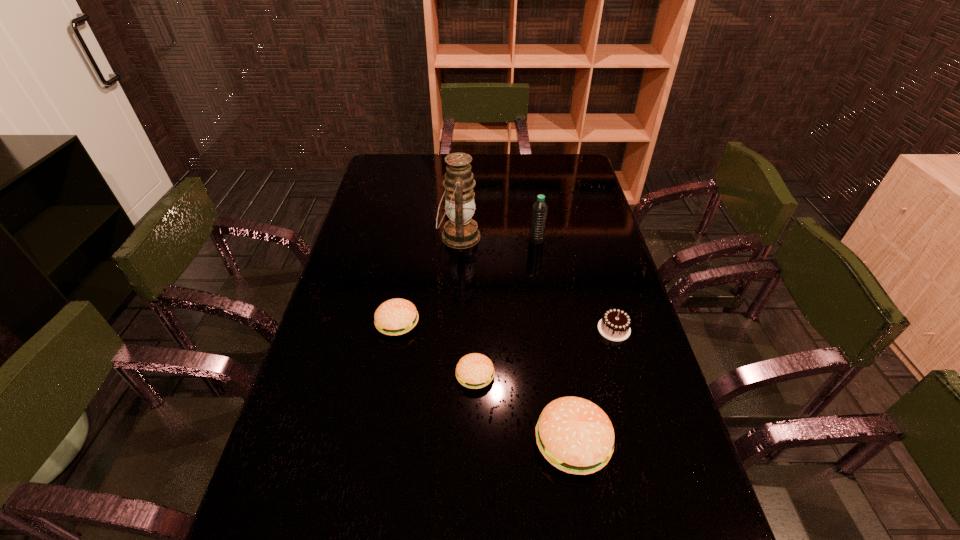
The width and height of the screenshot is (960, 540). I want to click on the leftmost patty, so click(x=397, y=316).

Find the location of a particular element. The image size is (960, 540). the farthest patty is located at coordinates (397, 316).

What are the coordinates of `the shortest patty` in the screenshot? It's located at pyautogui.click(x=475, y=370).

Locate an element on the screen. the second patty from left to right is located at coordinates (475, 370).

Where is `the third tallest object`? the third tallest object is located at coordinates (576, 436).

The width and height of the screenshot is (960, 540). Find the location of `the nearest object`. the nearest object is located at coordinates (576, 436).

This screenshot has width=960, height=540. I want to click on chocolate cake, so click(615, 324).

The height and width of the screenshot is (540, 960). In order to click on the tallest object in this screenshot , I will do `click(460, 232)`.

Where is `water bottle`? water bottle is located at coordinates (539, 208).

The width and height of the screenshot is (960, 540). What are the coordinates of `vacant region located 0.340m on the back of the second shortest patty` in the screenshot? It's located at (413, 237).